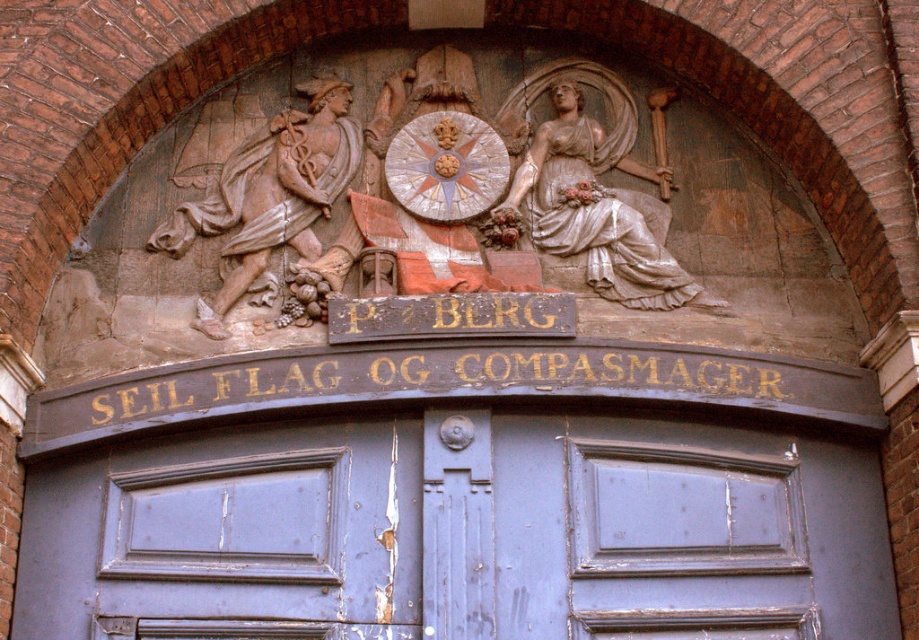
Question: Which point is farther to the camera?

Choices:
 (A) (341, 81)
 (B) (621, 109)
 (C) (310, 564)
 (D) (146, 499)

Answer: (A)

Question: Is peeling blue door at center below blue painted wood door at center?

Choices:
 (A) no
 (B) yes

Answer: (B)

Question: Can you confirm if peeling blue door at center is positioned to the left of blue painted wood door at center?

Choices:
 (A) yes
 (B) no

Answer: (B)

Question: Can you confirm if peeling blue door at center is positioned to the right of white marble statue at upper right?

Choices:
 (A) no
 (B) yes

Answer: (A)

Question: Which point is farther to the camera?

Choices:
 (A) marble statue of man at left
 (B) blue painted wood door at center
 (C) white marble statue at upper right
 (D) peeling blue door at center

Answer: (C)

Question: Which of the following is the farthest from the observer?

Choices:
 (A) blue painted wood door at center
 (B) white marble statue at upper right
 (C) peeling blue door at center
 (D) marble statue of man at left

Answer: (B)